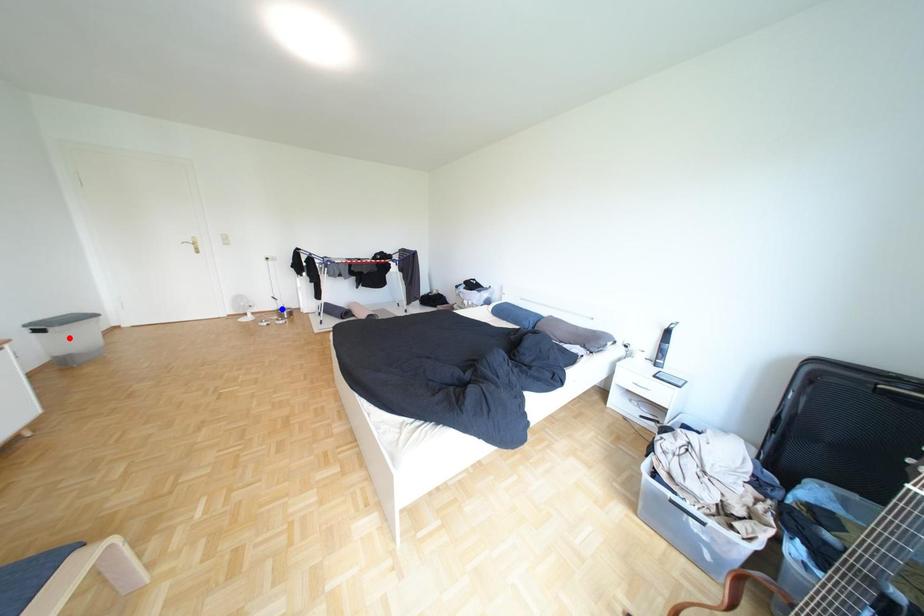
Question: In the image, two points are highlighted. Which point is nearer to the camera? Reply with the corresponding letter.

Choices:
 (A) blue point
 (B) red point

Answer: (B)